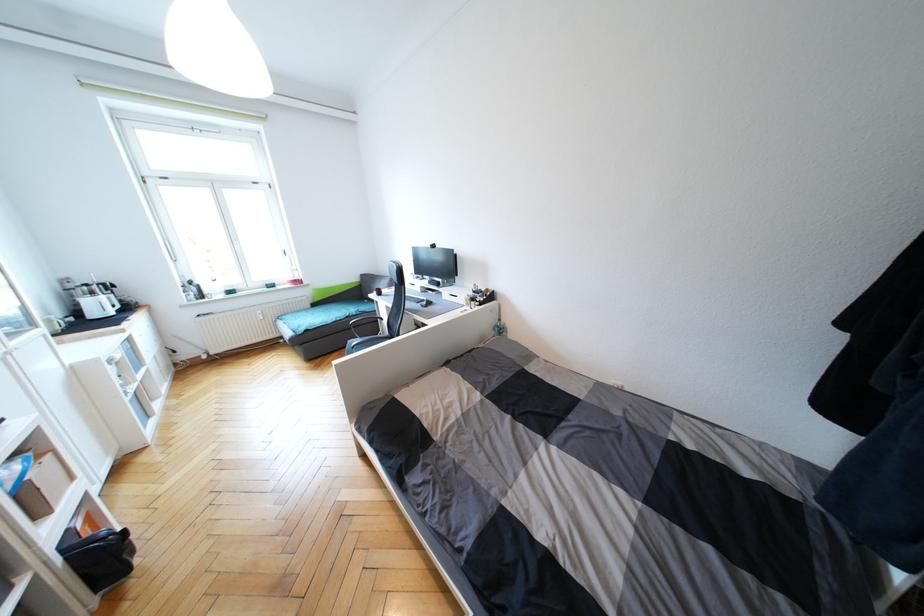
Find where to adjust the black webcam. Please return your answer as a coordinate pair (x, y).

(432, 245)